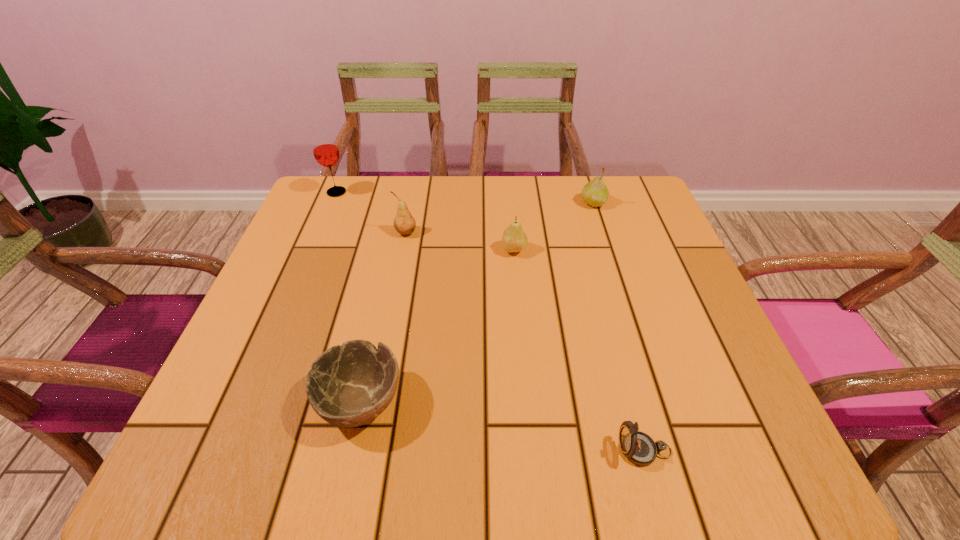
Where is `vacant space located on the left of the farthest pear`? The height and width of the screenshot is (540, 960). vacant space located on the left of the farthest pear is located at coordinates (535, 203).

I want to click on vacant space situated on the back of the second farthest pear, so click(x=417, y=179).

This screenshot has width=960, height=540. What are the coordinates of `vacant region located 0.200m on the back of the nearest pear` in the screenshot? It's located at (510, 195).

Identify the location of blank space located on the back of the bowl. (387, 281).

Identify the location of blank space located 0.370m on the face of the compass. This screenshot has height=540, width=960. (381, 450).

You are a GUI agent. You are given a task and a screenshot of the screen. Output one action in this format:
    pyautogui.click(x=<x>, y=<y>)
    Task: Click on the vacant area situated on the face of the compass
    
    Given the screenshot: What is the action you would take?
    pyautogui.click(x=516, y=450)

Where is `free location located on the face of the compass`? The width and height of the screenshot is (960, 540). free location located on the face of the compass is located at coordinates (470, 450).

Find the location of a particular element. The height and width of the screenshot is (540, 960). glass that is at the far edge is located at coordinates (324, 146).

Locate an element on the screen. The height and width of the screenshot is (540, 960). bowl that is at the near edge is located at coordinates (349, 385).

Where is `compass that is at the near edge`? The image size is (960, 540). compass that is at the near edge is located at coordinates (639, 448).